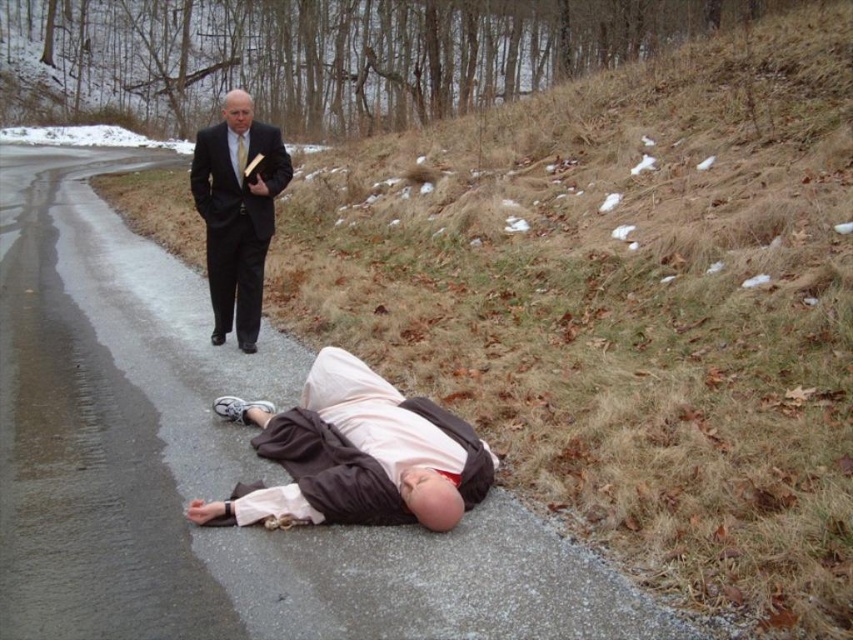
Based on the photo, does brown fabric shirt at lower center have a lesser height compared to matte black suit at upper left?

Indeed, brown fabric shirt at lower center has a lesser height compared to matte black suit at upper left.

Between point (367, 442) and point (267, 140), which one is positioned behind?

Point (267, 140)

Measure the distance between point [254,436] and camera.

A distance of 15.34 feet exists between point [254,436] and camera.

Locate an element on the screen. The image size is (853, 640). brown fabric shirt at lower center is located at coordinates (357, 454).